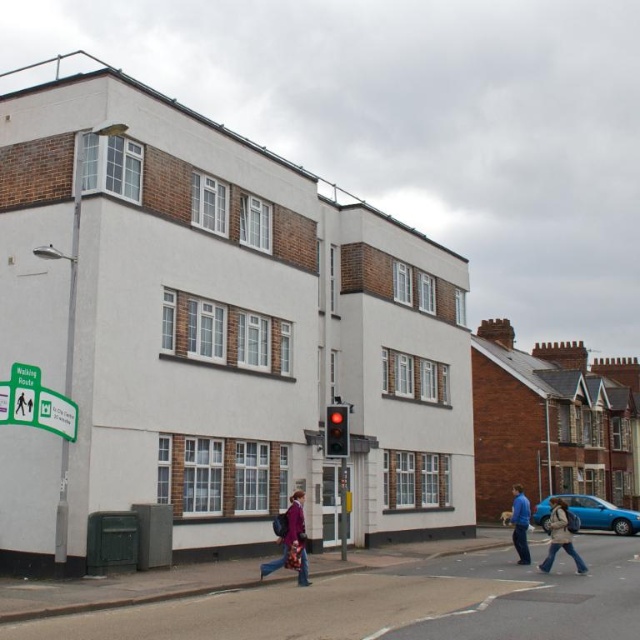
Who is taller, blue metallic car at lower right or green plastic sign at lower left?

With more height is blue metallic car at lower right.

Looking at this image, does blue metallic car at lower right appear on the right side of green plastic sign at lower left?

Correct, you'll find blue metallic car at lower right to the right of green plastic sign at lower left.

Who is more forward, (545, 509) or (22, 416)?

Positioned in front is point (22, 416).

This screenshot has width=640, height=640. I want to click on blue metallic car at lower right, so click(602, 515).

Between purple fabric coat at center and denim jacket at lower right, which one has less height?

With less height is purple fabric coat at center.

Is point (296, 536) behind point (560, 513)?

That is False.

At what (x,y) coordinates should I click in order to perform the action: click on purple fabric coat at center. Please return your answer as a coordinate pair (x, y). The image size is (640, 640). Looking at the image, I should click on (291, 540).

Based on the photo, does blue cotton shirt at center come behind green plastic sign at lower left?

Yes, blue cotton shirt at center is further from the viewer.

Locate an element on the screen. The height and width of the screenshot is (640, 640). blue cotton shirt at center is located at coordinates (520, 524).